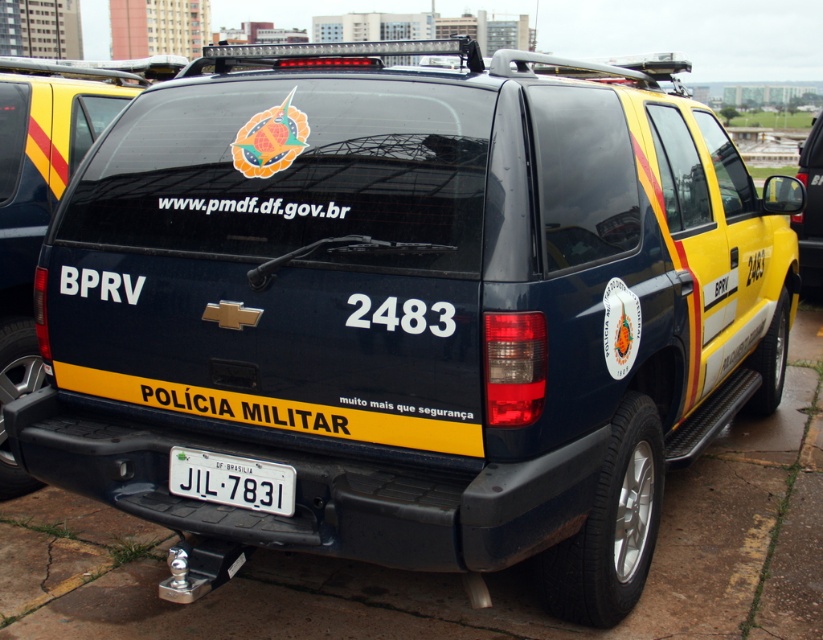
You are a traffic officer inspecting a vehicle and need to check the license plate. The vehicle has a matte black suv at center and a white plastic license plate at center. Which object is closer to you, the officer, when you are facing the vehicle?

The matte black suv at center is closer to you than the white plastic license plate at center, so you would first see the matte black suv at center before the license plate when facing the vehicle.

You are a traffic officer inspecting a vehicle. You need to compare the dimensions of the matte black suv at center and the white plastic license plate at center. Which one has a greater width?

The matte black suv at center has a greater width than the white plastic license plate at center according to the description.